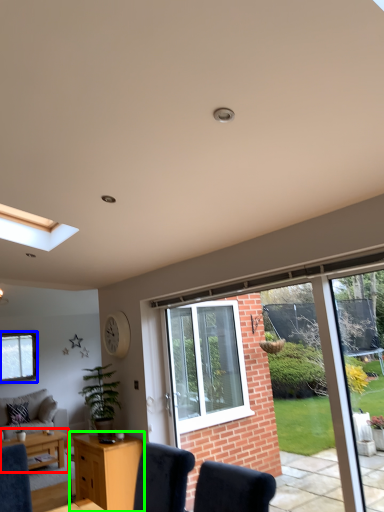
Question: Estimate the real-world distances between objects in this image. Which object is farther from table (highlighted by a red box), window (highlighted by a blue box) or desk (highlighted by a green box)?

Choices:
 (A) window
 (B) desk

Answer: (A)